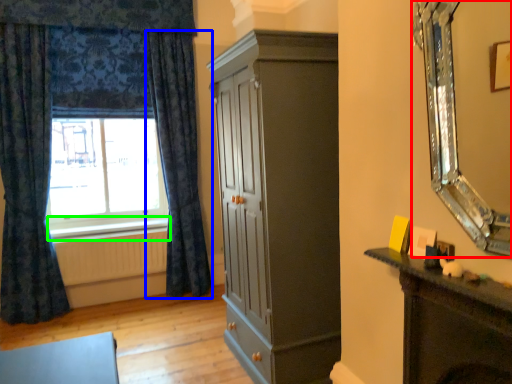
Question: Which is nearer to the mirror (highlighted by a red box)? curtain (highlighted by a blue box) or window sill (highlighted by a green box).

Choices:
 (A) curtain
 (B) window sill

Answer: (A)